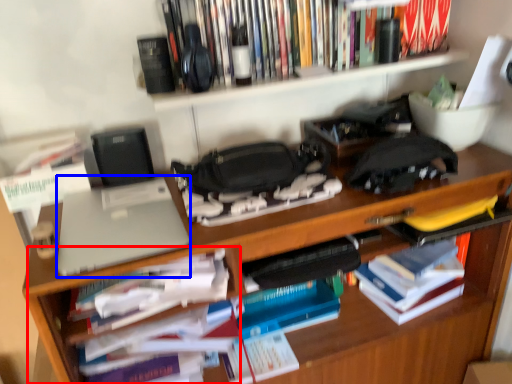
Question: Among these objects, which one is farthest to the camera, cabinet (highlighted by a red box) or laptop (highlighted by a blue box)?

Choices:
 (A) cabinet
 (B) laptop

Answer: (A)